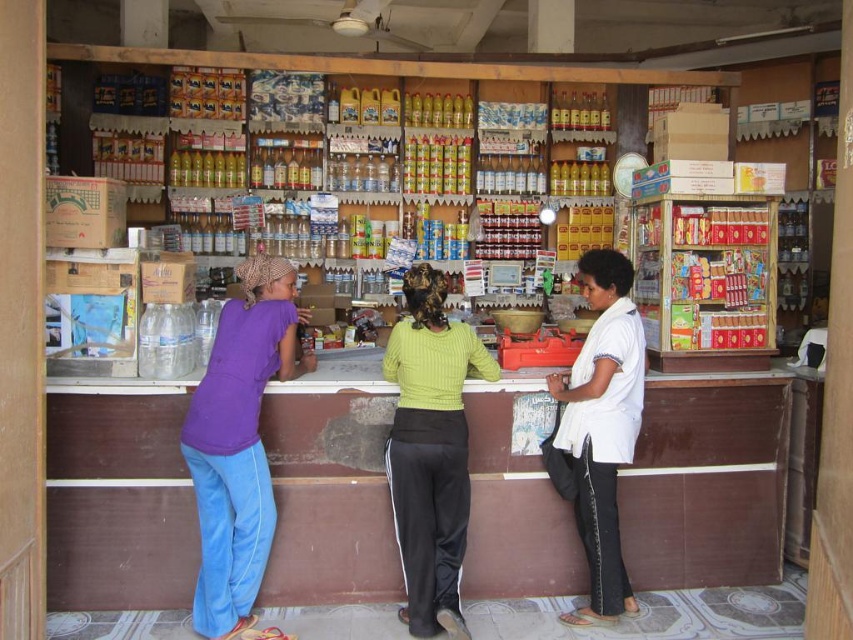
Question: Which object is the farthest from the ribbed green sweater at center?

Choices:
 (A) purple cotton shirt at left
 (B) white cotton shirt at center

Answer: (A)

Question: Is purple cotton shirt at left below ribbed green sweater at center?

Choices:
 (A) yes
 (B) no

Answer: (B)

Question: Does purple cotton shirt at left have a greater width compared to ribbed green sweater at center?

Choices:
 (A) no
 (B) yes

Answer: (A)

Question: Which point appears closest to the camera in this image?

Choices:
 (A) (601, 262)
 (B) (418, 582)
 (C) (244, 460)

Answer: (C)

Question: Which of the following is the closest to the observer?

Choices:
 (A) white cotton shirt at center
 (B) ribbed green sweater at center
 (C) purple cotton shirt at left

Answer: (C)

Question: Is purple cotton shirt at left above white cotton shirt at center?

Choices:
 (A) yes
 (B) no

Answer: (B)